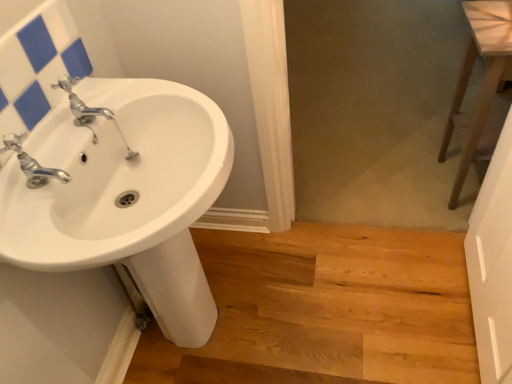
The image size is (512, 384). In order to click on vacant space behind transparent glass screen door at right in this screenshot , I will do `click(404, 276)`.